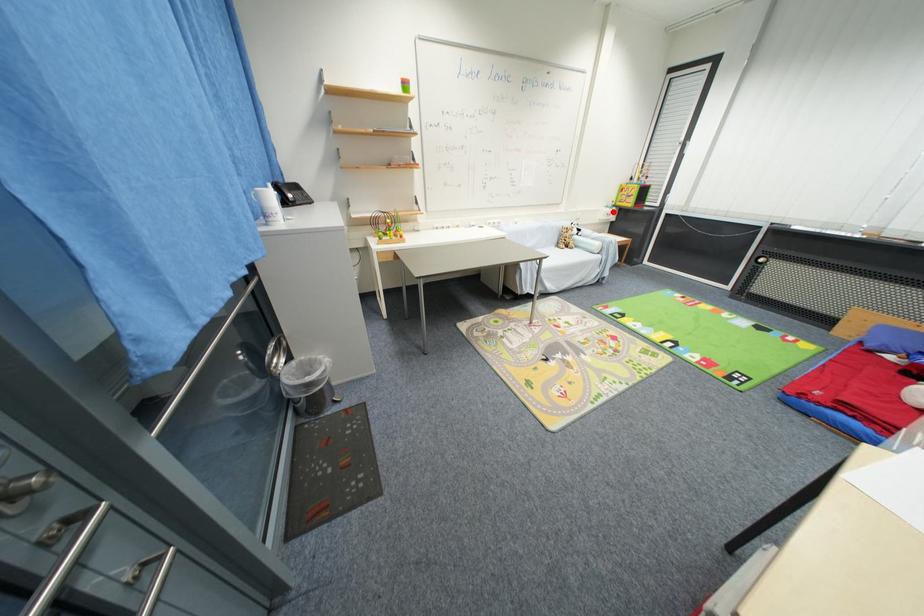
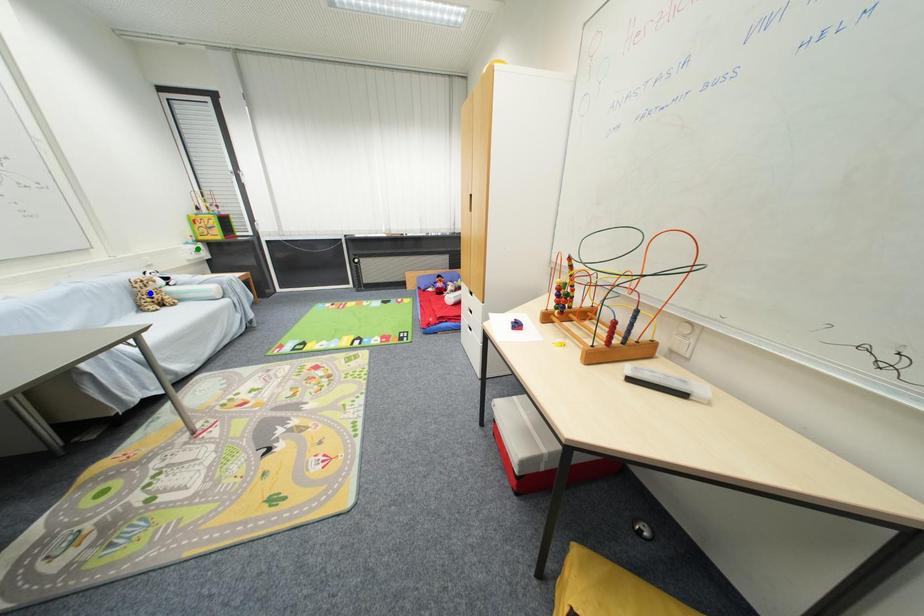
Question: I am providing you with two images of the same scene from different viewpoints. A red point is marked on the first image. You are given multiple points on the second image. Which point in image 2 represents the same 3d spot as the red point in image 1?

Choices:
 (A) yellow point
 (B) blue point
 (C) green point

Answer: (C)